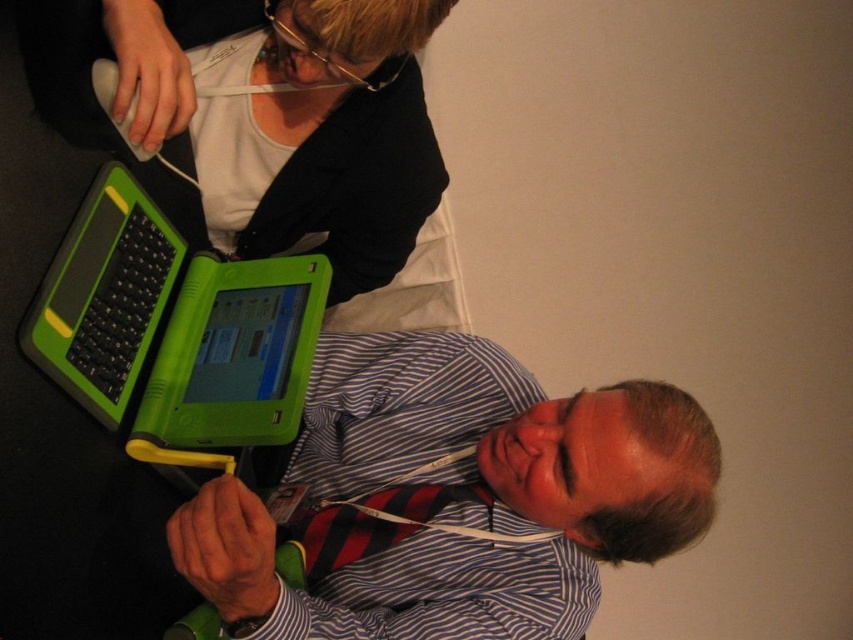
Is matte green laptop at lower center below red striped tie at lower center?

Incorrect, matte green laptop at lower center is not positioned below red striped tie at lower center.

Does matte green laptop at lower center appear over red striped tie at lower center?

Yes.

Is point (322, 563) positioned after point (421, 492)?

No, it is not.

You are a GUI agent. You are given a task and a screenshot of the screen. Output one action in this format:
    pyautogui.click(x=<x>, y=<y>)
    Task: Click on the matte green laptop at lower center
    The height and width of the screenshot is (640, 853).
    Given the screenshot: What is the action you would take?
    pyautogui.click(x=451, y=497)

Does green plastic laptop at lower left come in front of red striped tie at lower center?

Yes, it is.

Is point (223, 460) closer to viewer compared to point (280, 531)?

Yes, it is in front of point (280, 531).

Describe the element at coordinates (173, 333) in the screenshot. I see `green plastic laptop at lower left` at that location.

The image size is (853, 640). Find the location of `green plastic laptop at lower left`. green plastic laptop at lower left is located at coordinates (173, 333).

Is matte green laptop at lower center wider than green plastic keyboard at lower left?

Indeed, matte green laptop at lower center has a greater width compared to green plastic keyboard at lower left.

Identify the location of matte green laptop at lower center. This screenshot has height=640, width=853. (451, 497).